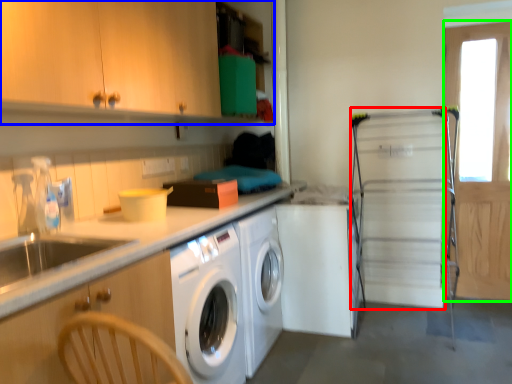
Question: Which is farther away from screen door (highlighted by a red box)? cabinetry (highlighted by a blue box) or screen door (highlighted by a green box)?

Choices:
 (A) cabinetry
 (B) screen door

Answer: (A)